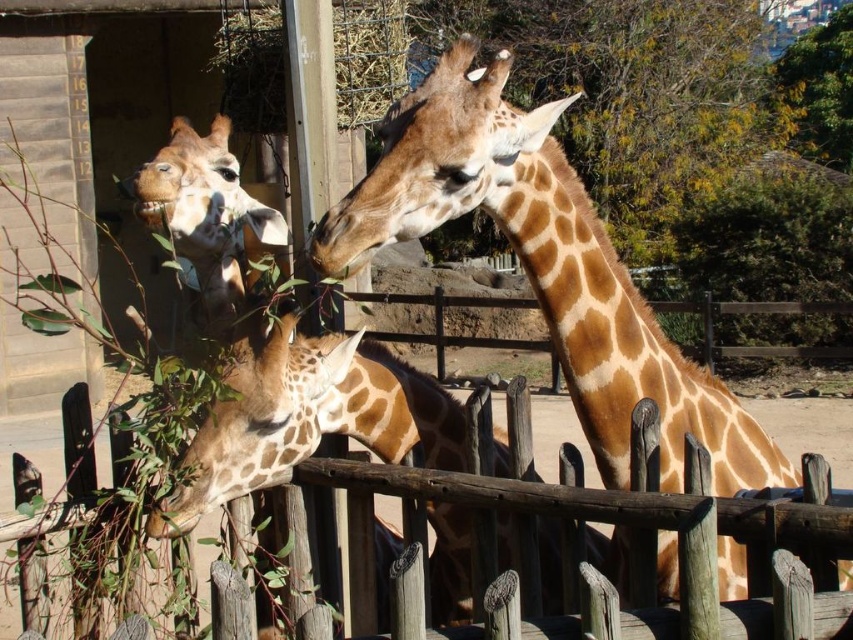
Question: Does green leafy tree at upper center appear over spotted brown giraffe at center?

Choices:
 (A) no
 (B) yes

Answer: (B)

Question: Estimate the real-world distances between objects in this image. Which object is closer to the spotted brown giraffe at center?

Choices:
 (A) yellow-green leaves at upper right
 (B) brown spotted giraffe at upper center
 (C) green leafy tree at upper center

Answer: (B)

Question: Is brown spotted giraffe at upper center thinner than yellow-green leaves at upper right?

Choices:
 (A) no
 (B) yes

Answer: (B)

Question: Does green leafy tree at upper center have a smaller size compared to brown spotted giraffe at upper left?

Choices:
 (A) yes
 (B) no

Answer: (B)

Question: Which object is closer to the camera taking this photo?

Choices:
 (A) green leafy tree at upper center
 (B) brown spotted giraffe at upper left
 (C) yellow-green leaves at upper right
 (D) wooden fence at lower center

Answer: (D)

Question: Estimate the real-world distances between objects in this image. Which object is farther from the green leafy tree at upper center?

Choices:
 (A) wooden fence at lower center
 (B) brown spotted giraffe at upper left
 (C) brown spotted giraffe at upper center
 (D) spotted brown giraffe at center

Answer: (C)